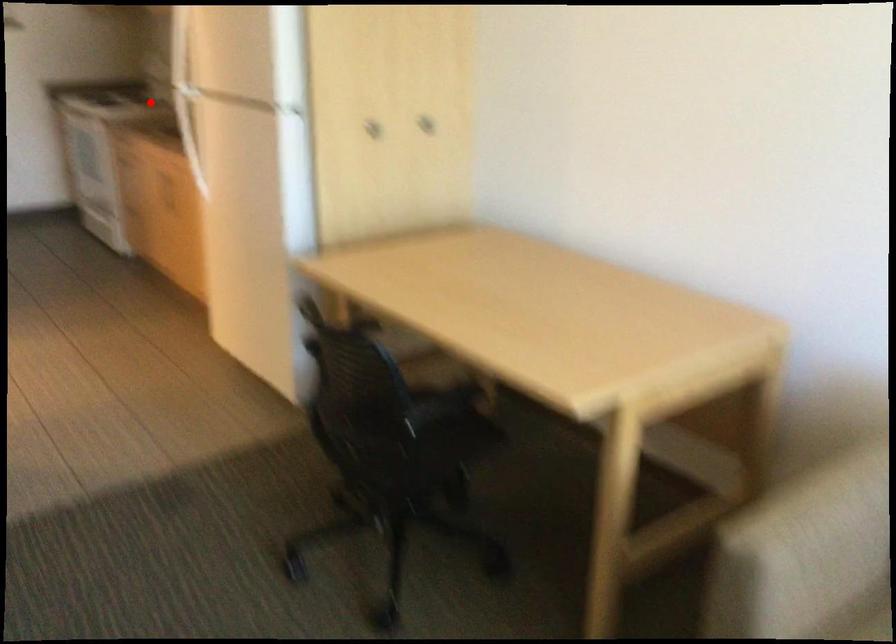
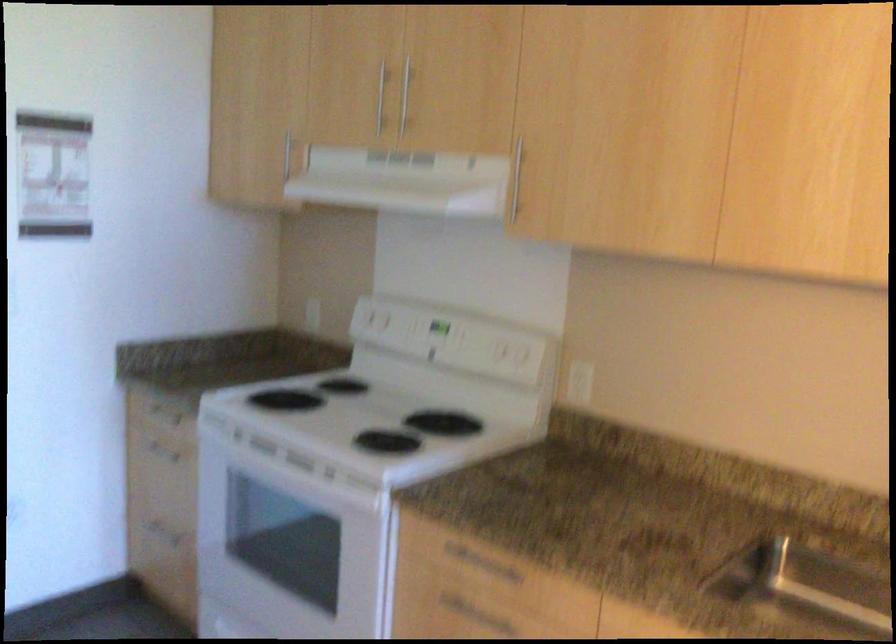
The point at the highlighted location is marked in the first image. Where is the corresponding point in the second image?

(367, 415)